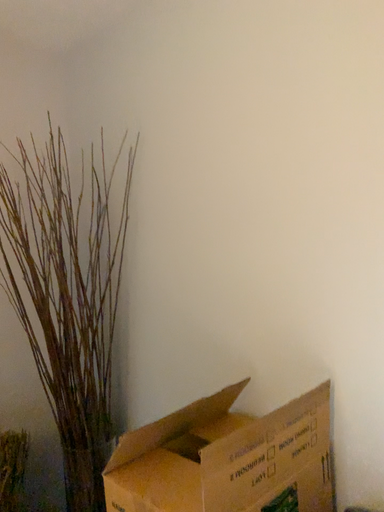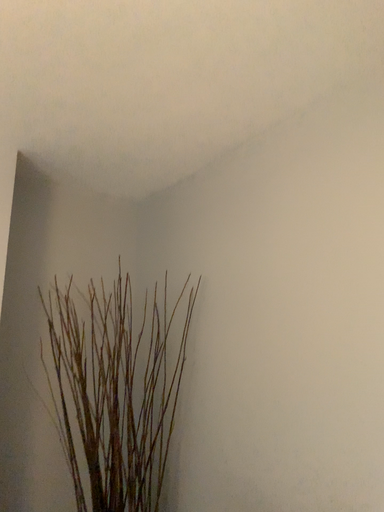
Question: Which way did the camera rotate in the video?

Choices:
 (A) rotated right
 (B) rotated left

Answer: (B)